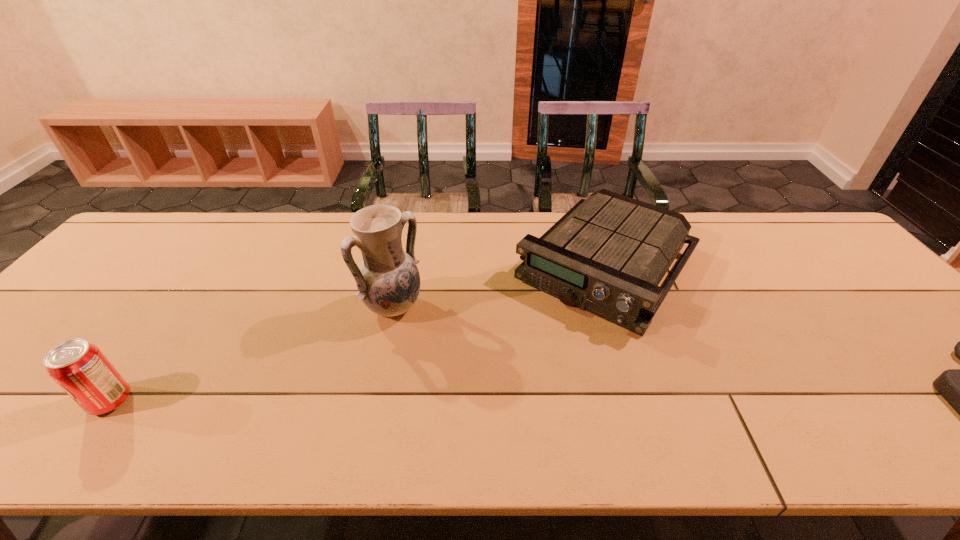
Where is `vacant space on the desktop that is between the soda and the rightmost object and is positioned on the front panel of the third object from left to right`? The width and height of the screenshot is (960, 540). vacant space on the desktop that is between the soda and the rightmost object and is positioned on the front panel of the third object from left to right is located at coordinates (495, 401).

This screenshot has width=960, height=540. In order to click on free space on the desktop that is between the leftmost object and the rightmost object and is positioned on either side of the second object from left to right in this screenshot , I will do `click(508, 401)`.